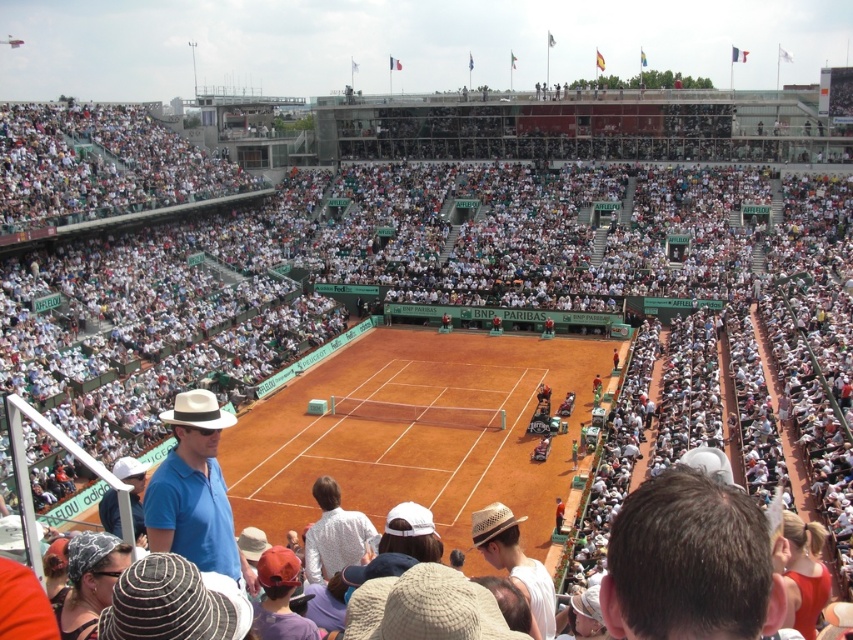
Where is `matte blue shirt at lower left`? The width and height of the screenshot is (853, 640). matte blue shirt at lower left is located at coordinates (194, 490).

What do you see at coordinates (194, 490) in the screenshot? I see `matte blue shirt at lower left` at bounding box center [194, 490].

Who is more forward, [144,493] or [106,508]?

Point [144,493] is in front.

Locate an element on the screen. The image size is (853, 640). matte blue shirt at lower left is located at coordinates (194, 490).

Is brown hair at upper center wider than white straw hat at lower center?

In fact, brown hair at upper center might be narrower than white straw hat at lower center.

Is brown hair at upper center to the left of white straw hat at lower center from the viewer's perspective?

No, brown hair at upper center is not to the left of white straw hat at lower center.

Where is `brown hair at upper center`? The width and height of the screenshot is (853, 640). brown hair at upper center is located at coordinates (689, 563).

Can you confirm if brown hair at upper center is taller than matte blue shirt at lower left?

No.

Does point (636, 586) come farther from viewer compared to point (228, 563)?

No.

Is point (756, 582) more distant than point (189, 554)?

No.

The width and height of the screenshot is (853, 640). I want to click on brown hair at upper center, so click(x=689, y=563).